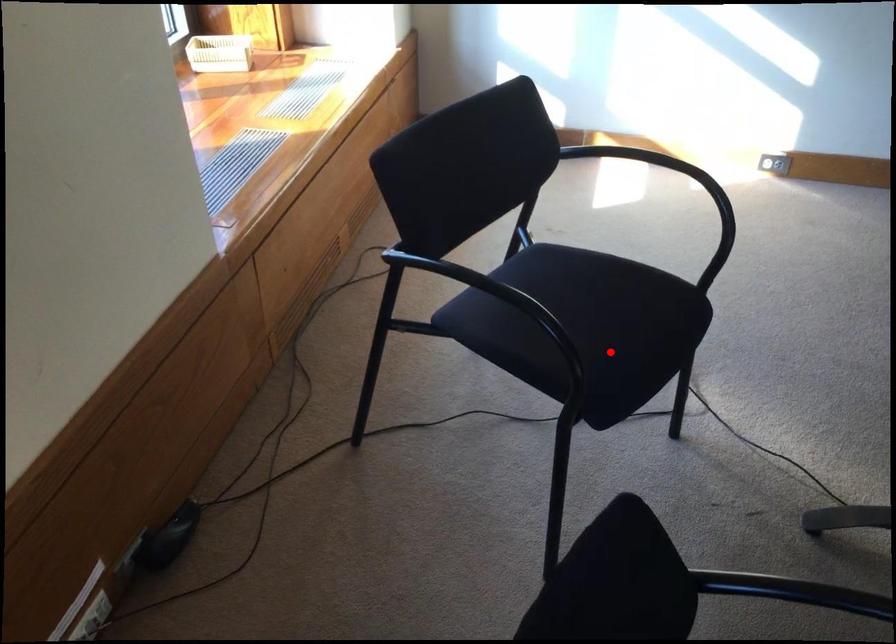
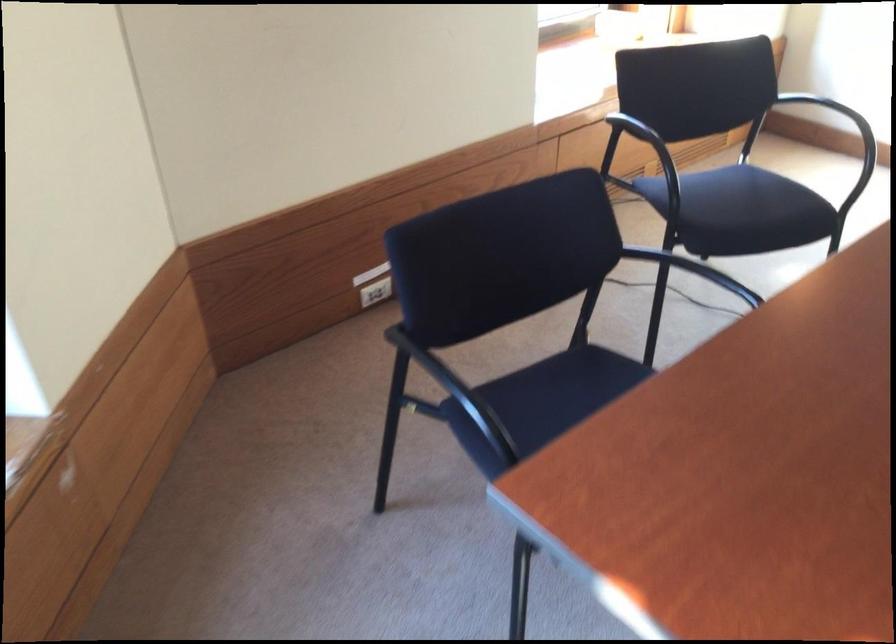
Find the pixel in the second image that matches the highlighted location in the first image.

(741, 211)